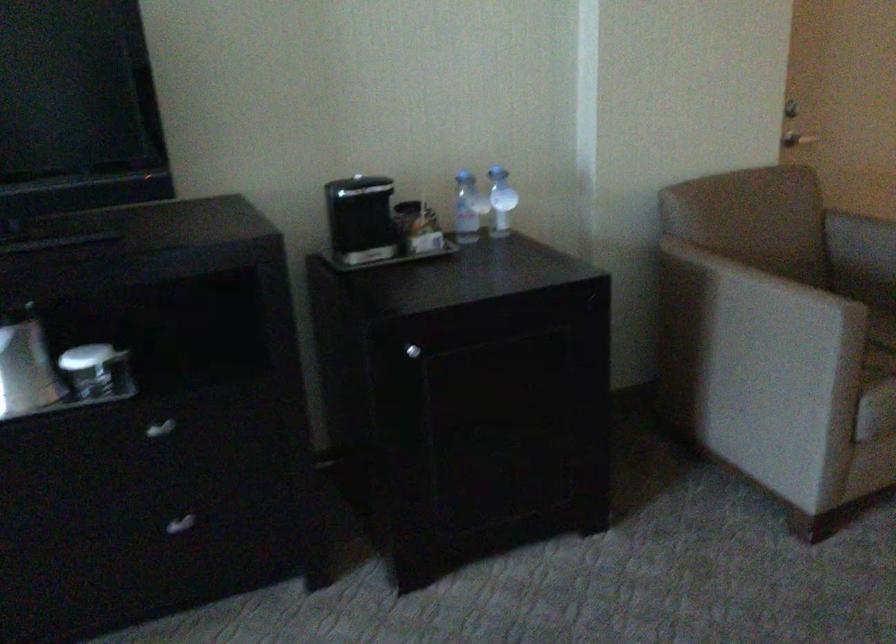
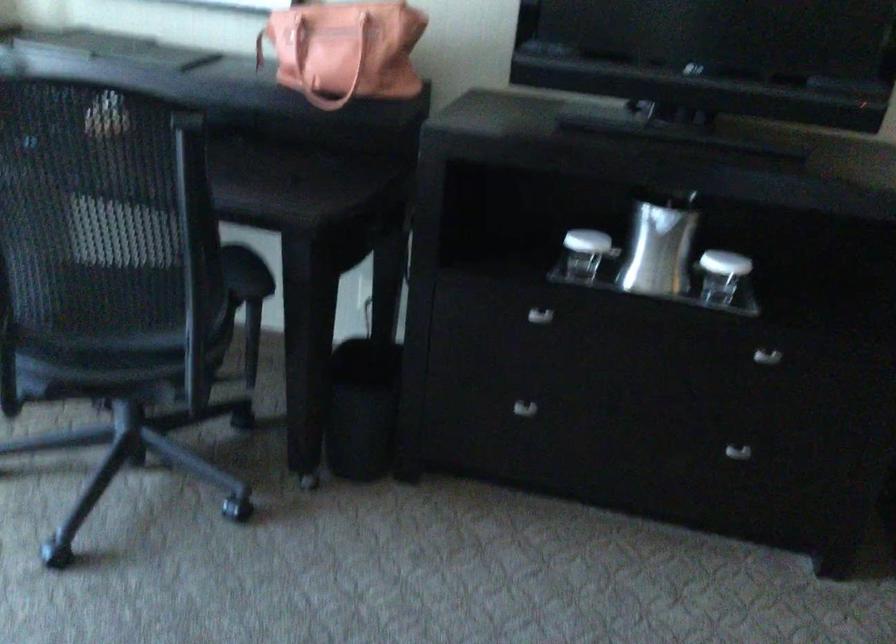
In the second image, find the point that corresponds to point (166, 430) in the first image.

(767, 357)